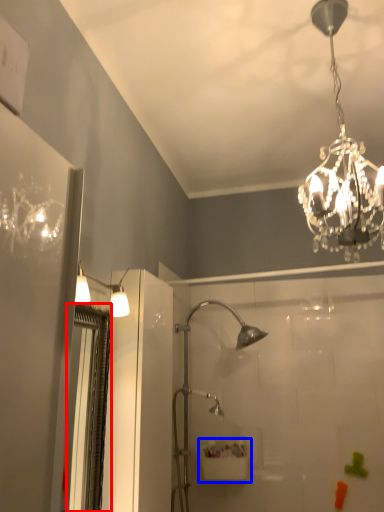
Question: Which of the following is the closest to the observer, screen door (highlighted by a red box) or sink (highlighted by a blue box)?

Choices:
 (A) screen door
 (B) sink

Answer: (A)